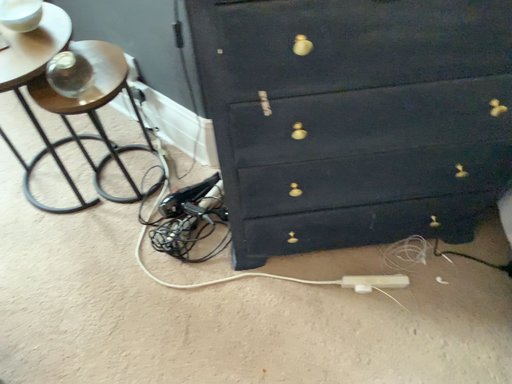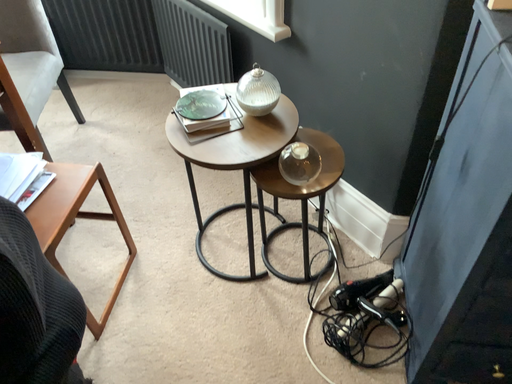
Question: Which way did the camera rotate in the video?

Choices:
 (A) rotated upward
 (B) rotated downward

Answer: (A)